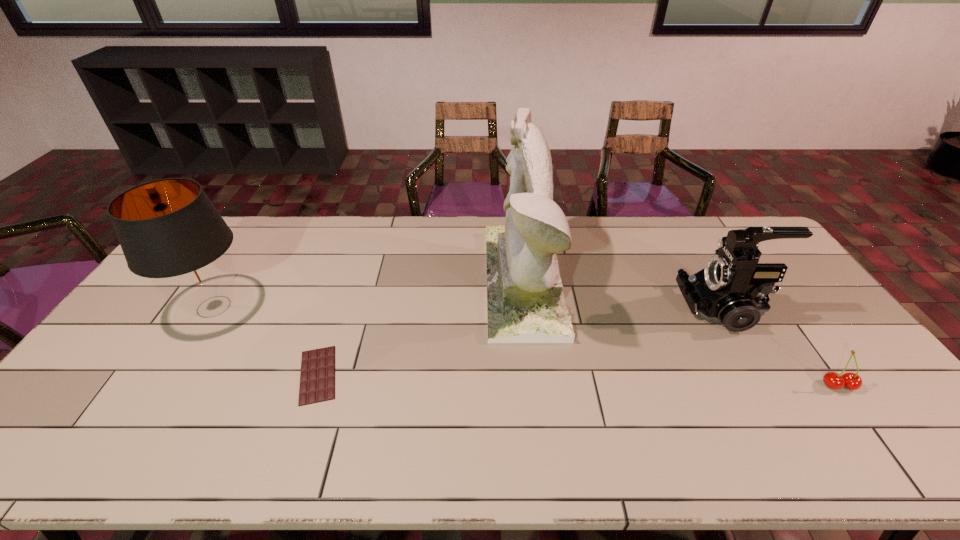
Where is `free space located 0.200m on the base of the sculpture`? This screenshot has width=960, height=540. free space located 0.200m on the base of the sculpture is located at coordinates (425, 281).

Where is `free space located on the base of the sculpture`? free space located on the base of the sculpture is located at coordinates (416, 281).

Identify the location of blank space located on the base of the sculpture. (446, 281).

This screenshot has height=540, width=960. In order to click on free region located 0.100m on the right of the second tallest object in this screenshot , I will do `click(289, 307)`.

Where is `vacant space positioned 0.130m on the lens mount of the camcorder`? This screenshot has height=540, width=960. vacant space positioned 0.130m on the lens mount of the camcorder is located at coordinates (640, 308).

Locate an element on the screen. This screenshot has height=540, width=960. free space located 0.060m on the lens mount of the camcorder is located at coordinates (663, 308).

Identify the location of free space located on the lens mount of the camcorder. This screenshot has height=540, width=960. (578, 308).

Find the location of a particular element. Image resolution: width=960 pixels, height=540 pixels. blank space located 0.170m with the stems of the fourth tallest object pointing upwards is located at coordinates (892, 458).

Locate an element on the screen. free spot located on the left of the shortest object is located at coordinates (180, 375).

What are the coordinates of `object positioned at the far edge` in the screenshot? It's located at (525, 302).